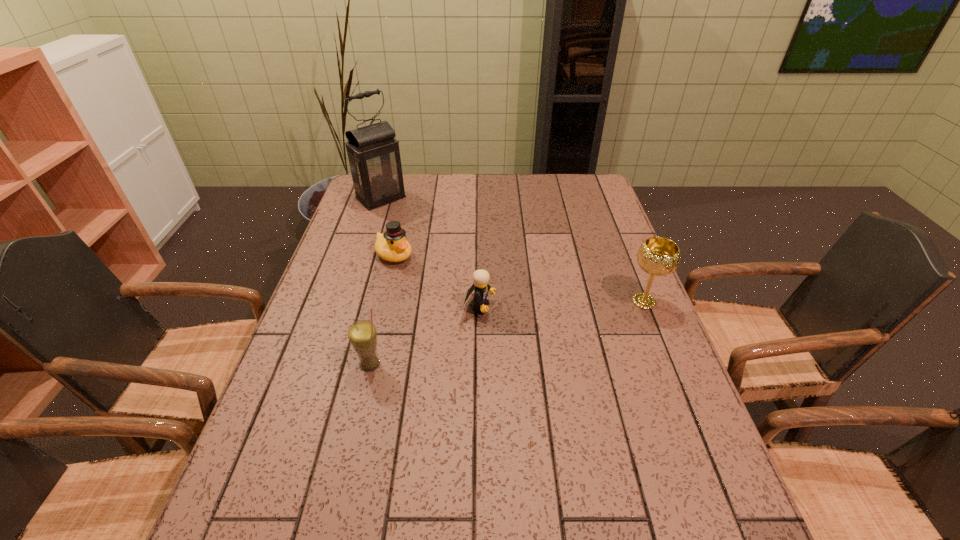
You are a GUI agent. You are given a task and a screenshot of the screen. Output one action in this format:
    pyautogui.click(x=<x>, y=<y>)
    Task: Click on the vacant area situated on the front-facing side of the duck
    This screenshot has height=540, width=960.
    Given the screenshot: What is the action you would take?
    pyautogui.click(x=444, y=291)

At what (x,y) coordinates should I click in order to perform the action: click on free space located on the front-facing side of the second object from right to left. Please return your answer as a coordinate pair (x, y). Looking at the image, I should click on (619, 337).

The width and height of the screenshot is (960, 540). I want to click on blank space located on the front-facing side of the second object from right to left, so click(x=599, y=333).

The height and width of the screenshot is (540, 960). I want to click on free space located 0.250m on the front-facing side of the second object from right to left, so click(590, 331).

This screenshot has width=960, height=540. Identify the location of vacant area situated 0.370m on the front-facing side of the tallest object. (456, 260).

Locate an element on the screen. This screenshot has width=960, height=540. vacant space positioned on the front-facing side of the tallest object is located at coordinates (420, 230).

Identify the location of vacant space located on the front-facing side of the tallest object. This screenshot has height=540, width=960. (448, 253).

You are a GUI agent. You are given a task and a screenshot of the screen. Output one action in this format:
    pyautogui.click(x=<x>, y=<y>)
    Task: Click on the object that is positioned at the far edge
    This screenshot has height=540, width=960.
    Given the screenshot: What is the action you would take?
    pyautogui.click(x=374, y=157)

At what (x,y) coordinates should I click in order to perform the action: click on duck that is at the left edge. Please return your answer as a coordinate pair (x, y). Looking at the image, I should click on (392, 246).

At what (x,y) coordinates should I click in order to perform the action: click on lantern located in the left edge section of the desktop. Please return your answer as a coordinate pair (x, y). This screenshot has width=960, height=540. Looking at the image, I should click on (374, 157).